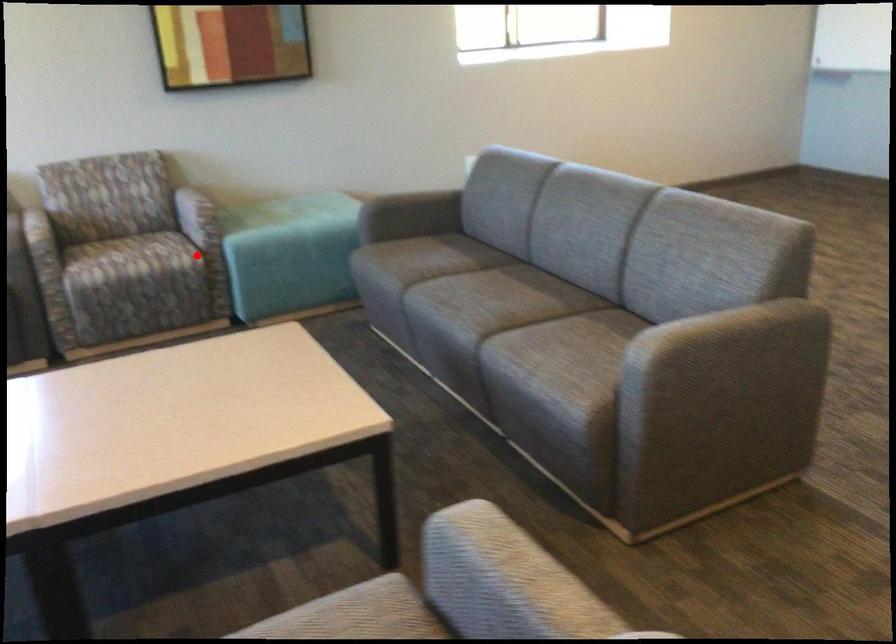
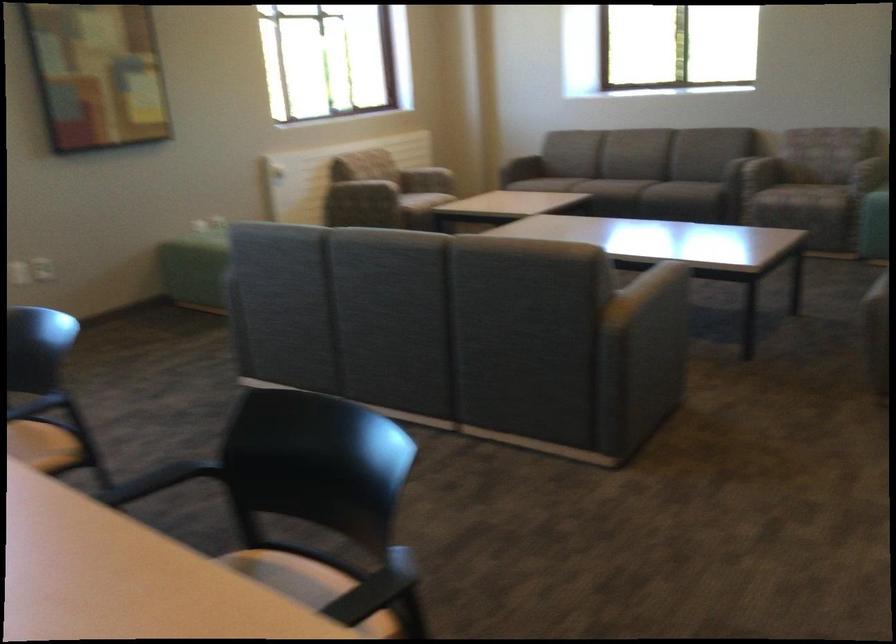
Question: I am providing you with two images of the same scene from different viewpoints. In image1, a red point is highlighted. Considering the same 3D point in image2, which of the following is correct?

Choices:
 (A) It is closer
 (B) It is farther

Answer: (B)